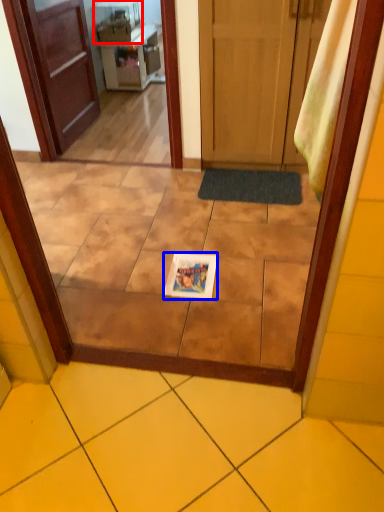
Question: Which object appears farthest to the camera in this image, appliance (highlighted by a red box) or copy (highlighted by a blue box)?

Choices:
 (A) appliance
 (B) copy

Answer: (A)